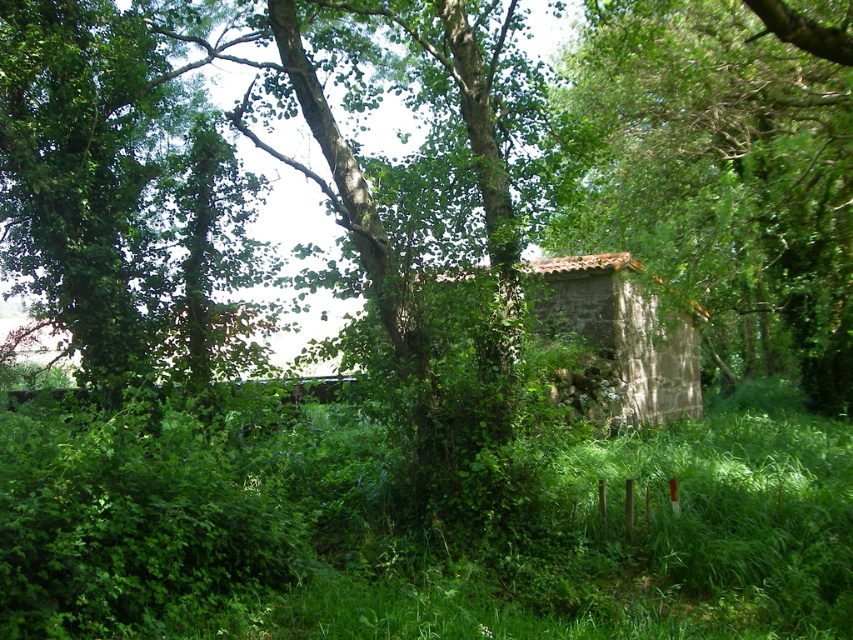
You are a gardener trying to clear the area around the old stone structure. Which object between the green leafy grass at center and the green leafy tree at center has a wider spread?

The green leafy grass at center has a wider spread than the green leafy tree at center according to the description provided.